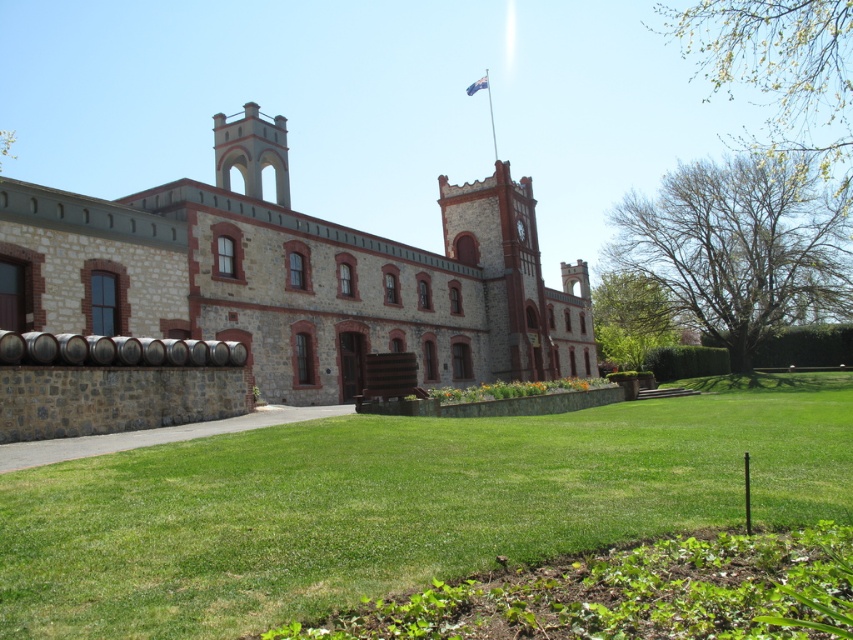
Question: Considering the real-world distances, which object is closest to the green grass at center?

Choices:
 (A) smooth stone tower at upper center
 (B) stone brick winery at center

Answer: (B)

Question: Can you confirm if green grass at center is positioned above stone brick winery at center?

Choices:
 (A) yes
 (B) no

Answer: (B)

Question: Which of these objects is positioned closest to the stone brick winery at center?

Choices:
 (A) green grass at center
 (B) smooth stone tower at upper center

Answer: (B)

Question: Which object is closer to the camera taking this photo?

Choices:
 (A) green grass at center
 (B) smooth stone tower at upper center

Answer: (A)

Question: Can you confirm if green grass at center is positioned below stone brick winery at center?

Choices:
 (A) yes
 (B) no

Answer: (A)

Question: Observing the image, what is the correct spatial positioning of stone brick winery at center in reference to smooth stone tower at upper center?

Choices:
 (A) above
 (B) below

Answer: (B)